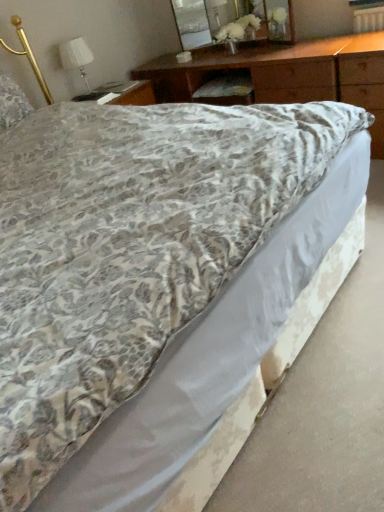
Question: Is white fabric lampshade at upper left completely or partially inside clear glass mirror at upper center?

Choices:
 (A) yes
 (B) no

Answer: (B)

Question: Does clear glass mirror at upper center have a greater height compared to white fabric lampshade at upper left?

Choices:
 (A) no
 (B) yes

Answer: (B)

Question: Is clear glass mirror at upper center to the right of white fabric lampshade at upper left from the viewer's perspective?

Choices:
 (A) no
 (B) yes

Answer: (B)

Question: Considering the relative sizes of clear glass mirror at upper center and white fabric lampshade at upper left in the image provided, is clear glass mirror at upper center bigger than white fabric lampshade at upper left?

Choices:
 (A) yes
 (B) no

Answer: (A)

Question: Does clear glass mirror at upper center have a lesser width compared to white fabric lampshade at upper left?

Choices:
 (A) yes
 (B) no

Answer: (A)

Question: Does clear glass mirror at upper center have a smaller size compared to white fabric lampshade at upper left?

Choices:
 (A) no
 (B) yes

Answer: (A)

Question: Is fluffy white pillow at upper left in front of white fabric lampshade at upper left?

Choices:
 (A) yes
 (B) no

Answer: (A)

Question: Is fluffy white pillow at upper left oriented towards white fabric lampshade at upper left?

Choices:
 (A) yes
 (B) no

Answer: (B)

Question: Is fluffy white pillow at upper left outside white fabric lampshade at upper left?

Choices:
 (A) yes
 (B) no

Answer: (A)

Question: Is fluffy white pillow at upper left wider than white fabric lampshade at upper left?

Choices:
 (A) yes
 (B) no

Answer: (A)

Question: Does fluffy white pillow at upper left touch white fabric lampshade at upper left?

Choices:
 (A) no
 (B) yes

Answer: (A)

Question: Is the depth of fluffy white pillow at upper left greater than that of white fabric lampshade at upper left?

Choices:
 (A) no
 (B) yes

Answer: (A)

Question: Is wooden at upper center behind fluffy white pillow at upper left?

Choices:
 (A) yes
 (B) no

Answer: (B)